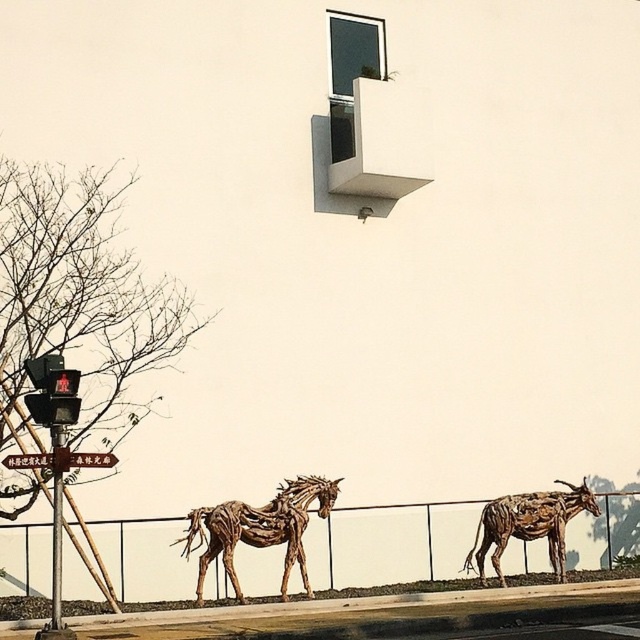
Question: Does wooden horse at center appear over metallic traffic light at left?

Choices:
 (A) yes
 (B) no

Answer: (B)

Question: Which point is closer to the camera?

Choices:
 (A) wooden sculpture of goat at lower right
 (B) metallic traffic light at left
 (C) wooden horse at center
 (D) metallic wire fence at lower center

Answer: (B)

Question: Does wooden horse at center have a lesser width compared to brushed metal sign at lower left?

Choices:
 (A) yes
 (B) no

Answer: (B)

Question: Which of the following is the closest to the observer?

Choices:
 (A) metallic traffic light at left
 (B) brushed metal sign at lower left

Answer: (B)

Question: Considering the real-world distances, which object is farthest from the brushed metal sign at lower left?

Choices:
 (A) wooden horse at center
 (B) metallic wire fence at lower center
 (C) wooden sculpture of goat at lower right
 (D) metallic traffic light at left

Answer: (C)

Question: Is metallic traffic light at left thinner than brushed metal sign at lower left?

Choices:
 (A) yes
 (B) no

Answer: (A)